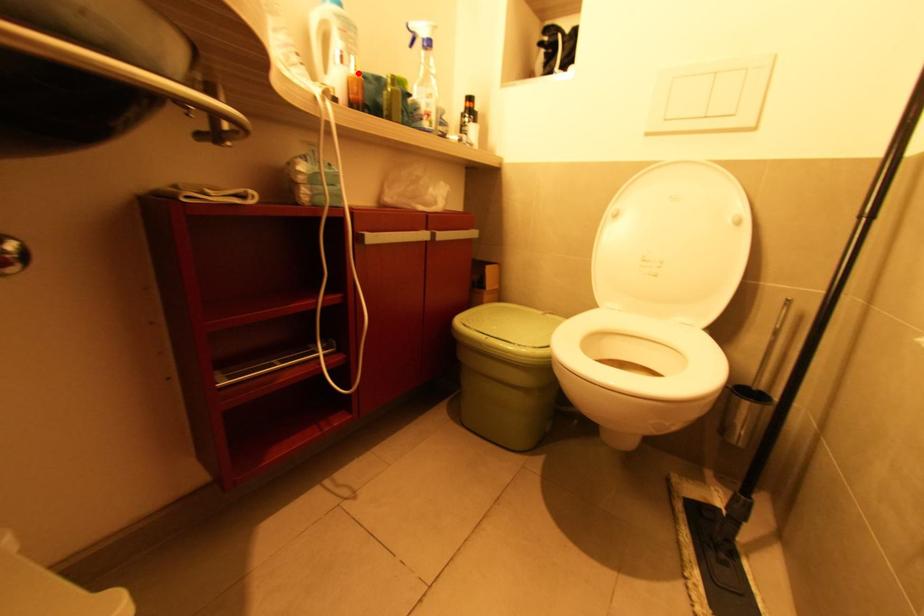
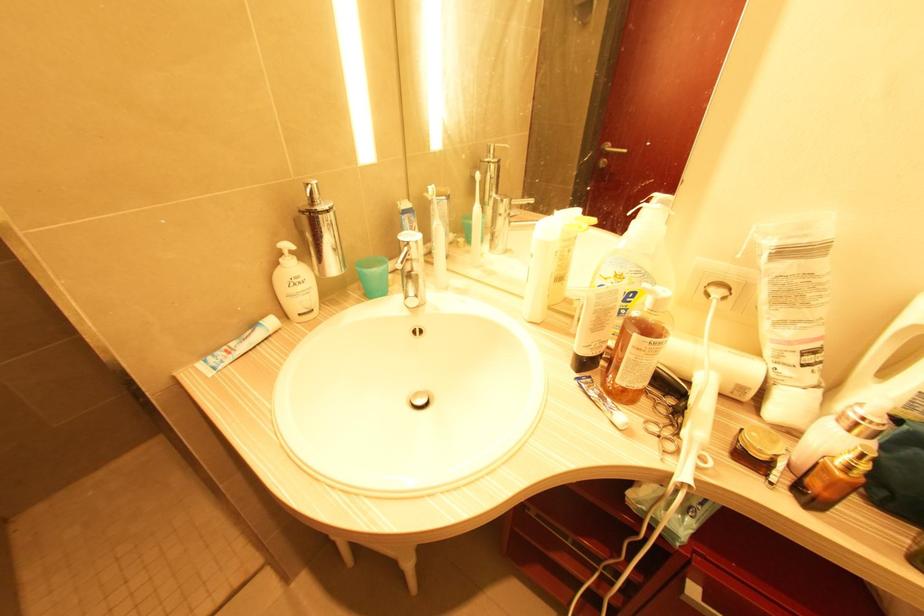
Where in the second image is the point corresponding to the highlighted location from the first image?

(850, 468)